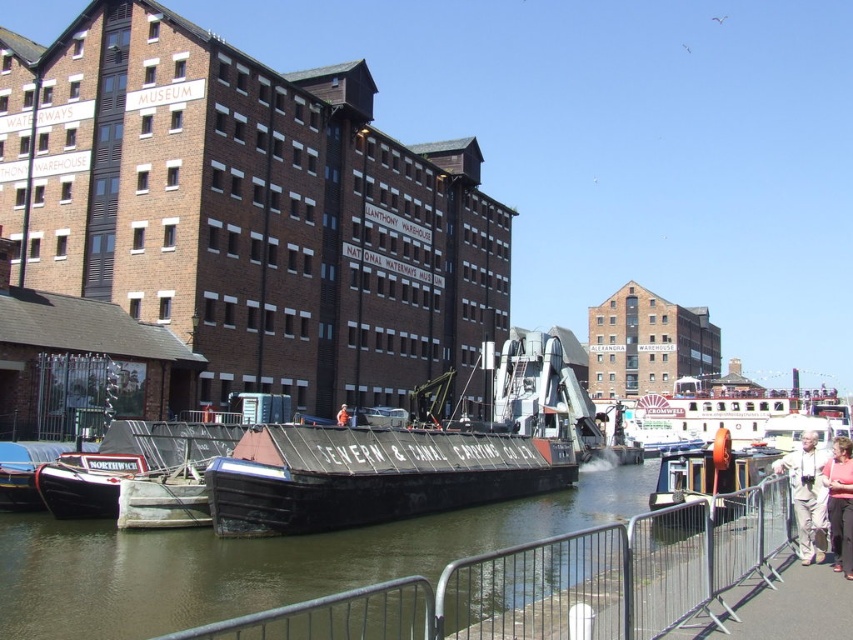
Question: Which point is closer to the camera?

Choices:
 (A) black matte barge at center
 (B) white wooden boat at center-right
 (C) light beige fabric pants at lower right
 (D) orange life vest at center

Answer: (C)

Question: Considering the relative positions of black matte barge at center and pink fabric at lower right in the image provided, where is black matte barge at center located with respect to pink fabric at lower right?

Choices:
 (A) left
 (B) right

Answer: (A)

Question: Is black matte barge at center above pink fabric at lower right?

Choices:
 (A) no
 (B) yes

Answer: (A)

Question: Does metal at center have a greater width compared to pink fabric at lower right?

Choices:
 (A) yes
 (B) no

Answer: (A)

Question: Which point appears closest to the camera in this image?

Choices:
 (A) (341, 404)
 (B) (845, 560)
 (C) (804, 545)
 (D) (680, 426)

Answer: (B)

Question: Estimate the real-world distances between objects in this image. Which object is closer to the black matte barge at center?

Choices:
 (A) orange life vest at center
 (B) white wooden boat at center-right
 (C) pink fabric at lower right
 (D) metal at center

Answer: (D)